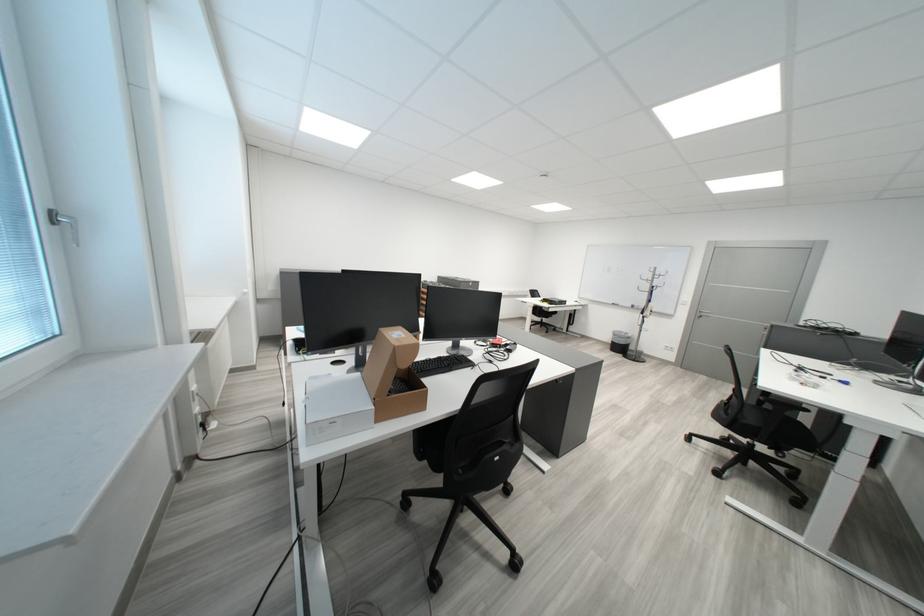
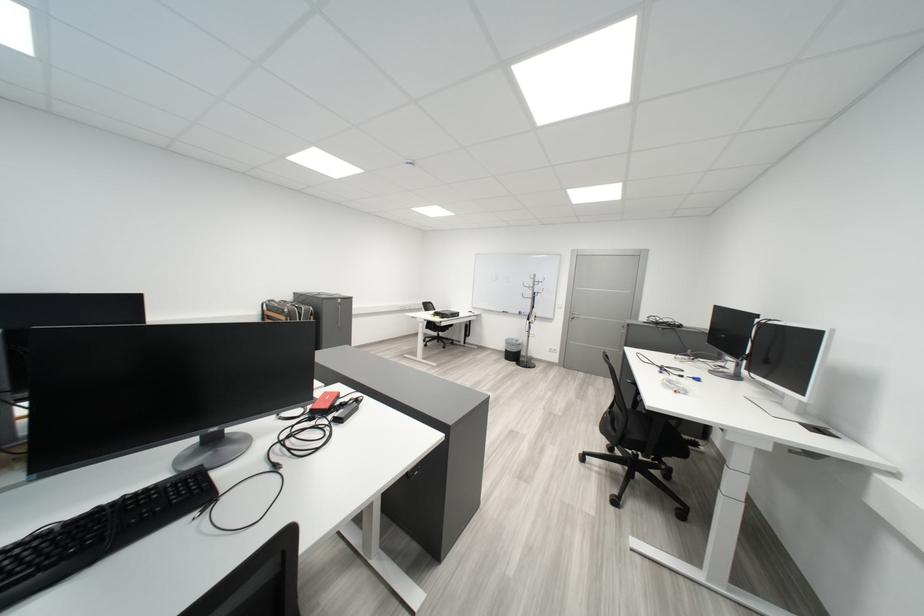
What movement of the cameraman would produce the second image?

The cameraman walked toward right, forward.